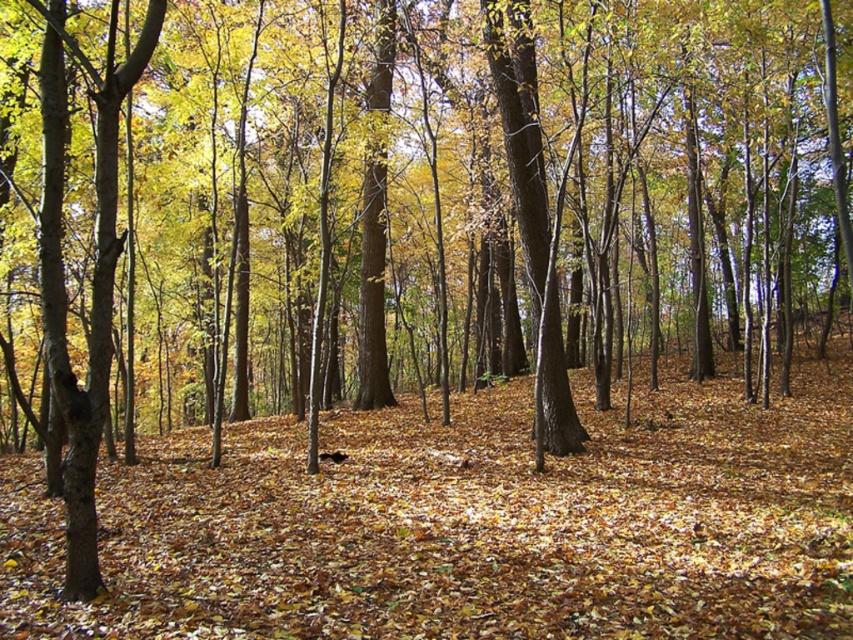
Question: Which of the following is the closest to the observer?

Choices:
 (A) smooth brown tree trunk at left
 (B) brown leaf litter at center

Answer: (B)

Question: Is smooth brown tree trunk at left positioned in front of smooth brown tree trunk at center?

Choices:
 (A) no
 (B) yes

Answer: (B)

Question: Among these objects, which one is nearest to the camera?

Choices:
 (A) smooth brown tree trunk at left
 (B) smooth brown tree trunk at center
 (C) brown leaf litter at center

Answer: (C)

Question: Which object is farther from the camera taking this photo?

Choices:
 (A) brown leaf litter at center
 (B) smooth brown tree trunk at center
 (C) smooth brown tree trunk at left

Answer: (B)

Question: Does brown leaf litter at center have a larger size compared to smooth brown tree trunk at center?

Choices:
 (A) yes
 (B) no

Answer: (A)

Question: Is brown leaf litter at center smaller than smooth brown tree trunk at left?

Choices:
 (A) yes
 (B) no

Answer: (B)